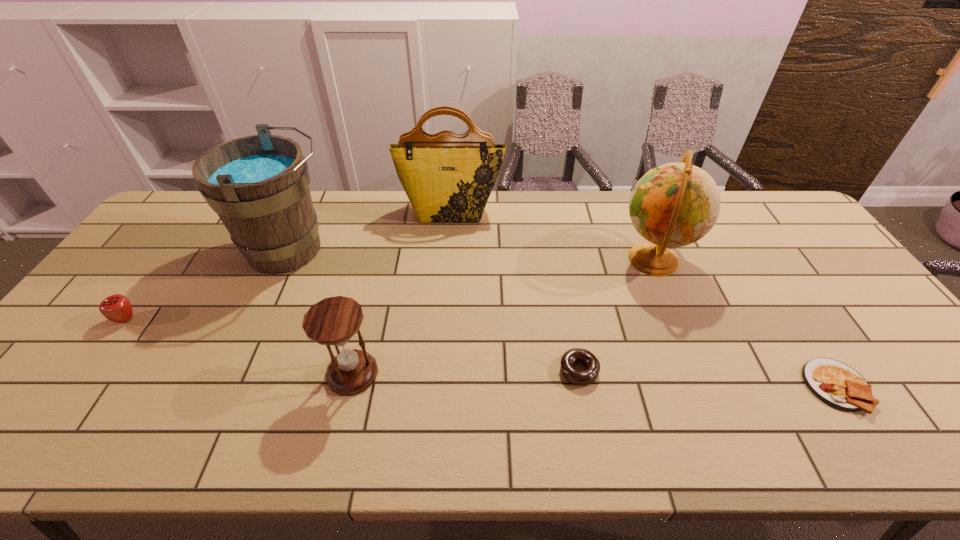
Identify the location of vacant space in between the globe and the rightmost object. This screenshot has height=540, width=960. (745, 323).

What are the coordinates of `free area in between the wine bucket and the doughnut` in the screenshot? It's located at (435, 310).

Locate an element on the screen. The width and height of the screenshot is (960, 540). vacant area between the third shortest object and the hourglass is located at coordinates (240, 346).

Identify the location of vacant area that lies between the sixth object from left to right and the omelet. (745, 323).

At what (x,y) coordinates should I click in order to perform the action: click on free space between the fourth farthest object and the rightmost object. Please return your answer as a coordinate pair (x, y). Image resolution: width=960 pixels, height=540 pixels. Looking at the image, I should click on (482, 353).

Where is `free spot between the rightmost object and the sixth object from right to left`? This screenshot has height=540, width=960. free spot between the rightmost object and the sixth object from right to left is located at coordinates (564, 319).

Point out which object is positioned as the fifth nearest to the hourglass. Please provide its 2D coordinates. Your answer should be formatted as a tuple, i.e. [(x, y)], where the tuple contains the x and y coordinates of a point satisfying the conditions above.

[(673, 205)]

Find the location of a particular element. object that ranks as the fifth closest to the tote bag is located at coordinates (117, 308).

Where is `free spot that satisfies the following two spatial constraints: 1. on the front-facing side of the omelet; 2. on the right side of the tote bag`? This screenshot has height=540, width=960. free spot that satisfies the following two spatial constraints: 1. on the front-facing side of the omelet; 2. on the right side of the tote bag is located at coordinates (x=438, y=387).

Locate an element on the screen. The width and height of the screenshot is (960, 540). vacant space that satisfies the following two spatial constraints: 1. on the front side of the omelet; 2. on the left side of the sixth object from left to right is located at coordinates (705, 387).